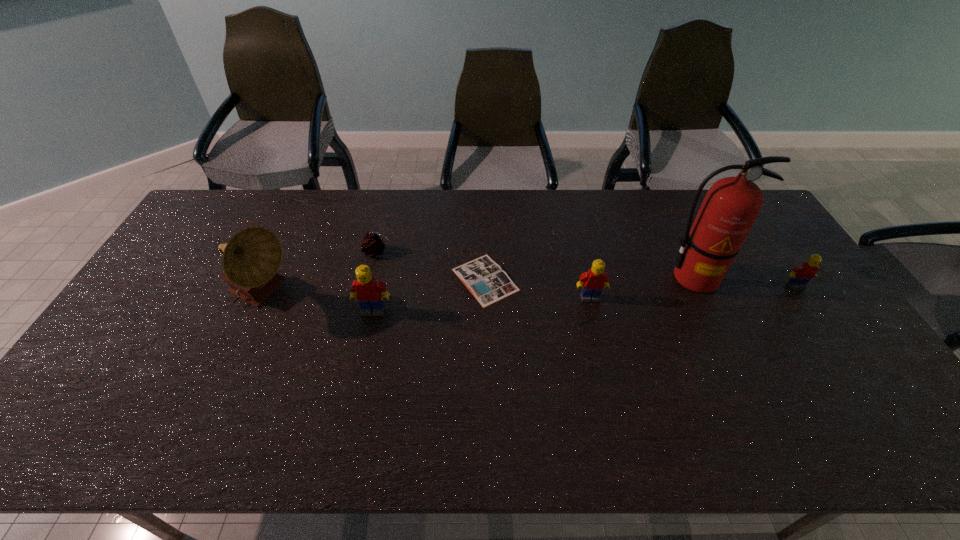
The height and width of the screenshot is (540, 960). Find the location of `the nearest Lego`. the nearest Lego is located at coordinates (368, 290).

The height and width of the screenshot is (540, 960). Identify the location of the fifth object from left to right. (594, 280).

Where is `the second shortest Lego`? This screenshot has height=540, width=960. the second shortest Lego is located at coordinates (594, 280).

You are a GUI agent. You are given a task and a screenshot of the screen. Output one action in this format:
    pyautogui.click(x=<x>, y=<y>)
    Task: Click on the fifth tallest object
    This screenshot has height=540, width=960.
    Given the screenshot: What is the action you would take?
    click(x=801, y=274)

Find the location of a particular element. the rightmost Lego is located at coordinates (801, 274).

The width and height of the screenshot is (960, 540). Find the location of `the leftmost object`. the leftmost object is located at coordinates (251, 258).

Where is `the second tallest object`? Image resolution: width=960 pixels, height=540 pixels. the second tallest object is located at coordinates (251, 258).

This screenshot has height=540, width=960. Find the location of `the tallest object`. the tallest object is located at coordinates (732, 204).

The height and width of the screenshot is (540, 960). I want to click on fire extinguisher, so click(732, 204).

This screenshot has height=540, width=960. Identify the location of book. (485, 279).